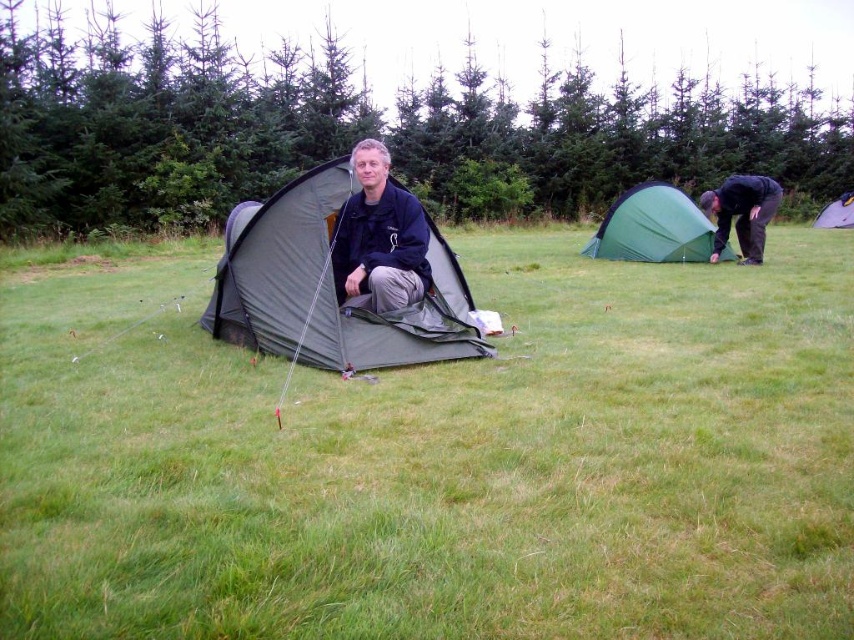
Question: Is green grass at center wider than matte black jacket at center?

Choices:
 (A) no
 (B) yes

Answer: (B)

Question: Which object appears closest to the camera in this image?

Choices:
 (A) dark gray fabric tent at right
 (B) matte black jacket at center

Answer: (B)

Question: Estimate the real-world distances between objects in this image. Which object is farther from the matte gray tent at upper right?

Choices:
 (A) green fabric tent at center
 (B) dark gray fabric tent at right
 (C) green fabric tent at right
 (D) matte black jacket at center

Answer: (D)

Question: Is green grass at center to the left of dark gray fabric tent at right from the viewer's perspective?

Choices:
 (A) yes
 (B) no

Answer: (A)

Question: Which is nearer to the matte gray tent at upper right?

Choices:
 (A) green fabric tent at center
 (B) green grass at center

Answer: (A)

Question: Where is dark gray fabric tent at right located in relation to matte gray tent at upper right in the image?

Choices:
 (A) below
 (B) above

Answer: (A)